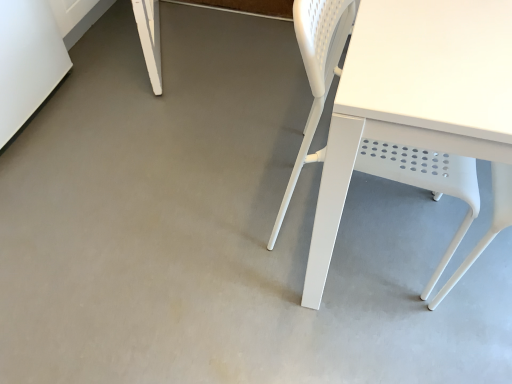
The height and width of the screenshot is (384, 512). What do you see at coordinates (316, 73) in the screenshot?
I see `white plastic chair at right` at bounding box center [316, 73].

You are a GUI agent. You are given a task and a screenshot of the screen. Output one action in this format:
    pyautogui.click(x=<x>, y=<y>)
    Task: Click on the white plastic chair at right
    This screenshot has height=384, width=512.
    Given the screenshot: What is the action you would take?
    pyautogui.click(x=316, y=73)

Where is `white plastic chair at right`? The height and width of the screenshot is (384, 512). white plastic chair at right is located at coordinates (316, 73).